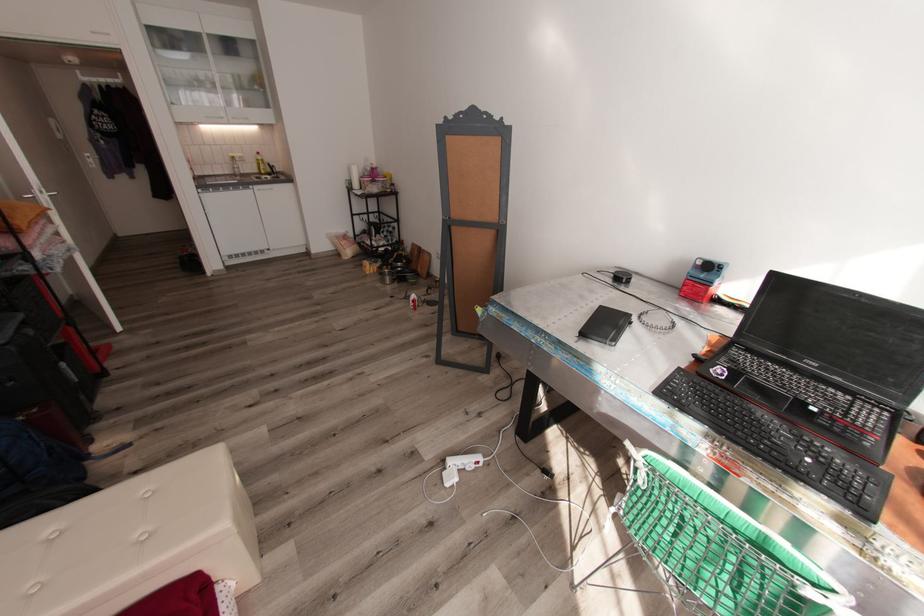
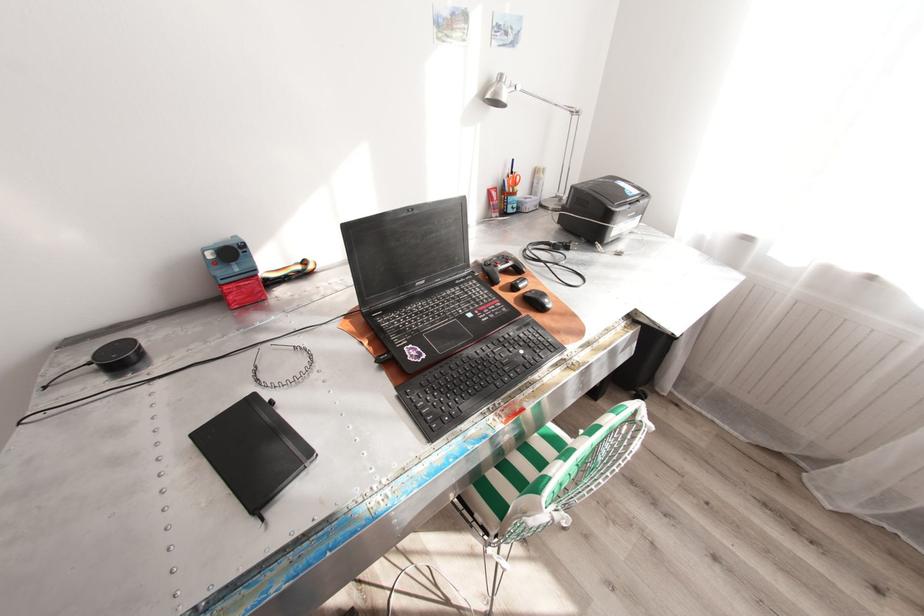
Where in the second image is the point corresponding to point 703,262 from the first image?

(215, 254)